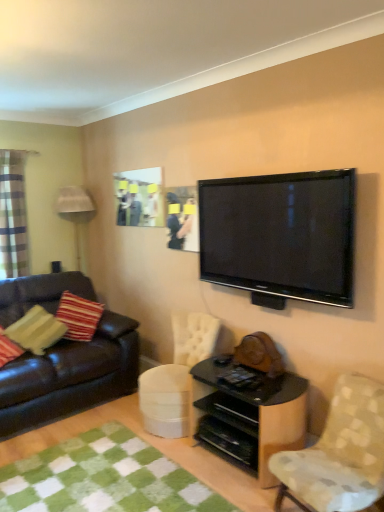
This screenshot has width=384, height=512. Identify the location of free space between white fabric swivel chair at center and black glossy shelf at lower center. (205, 462).